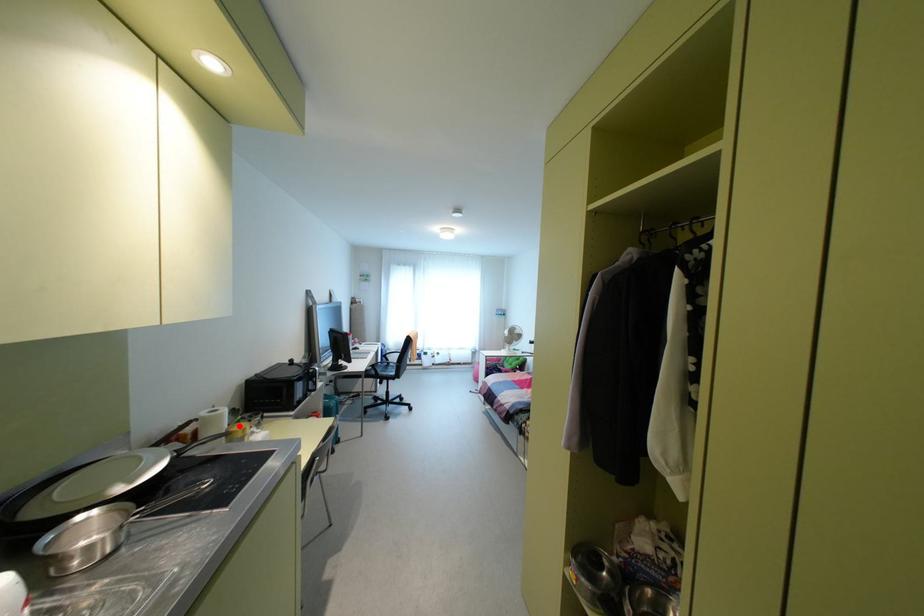
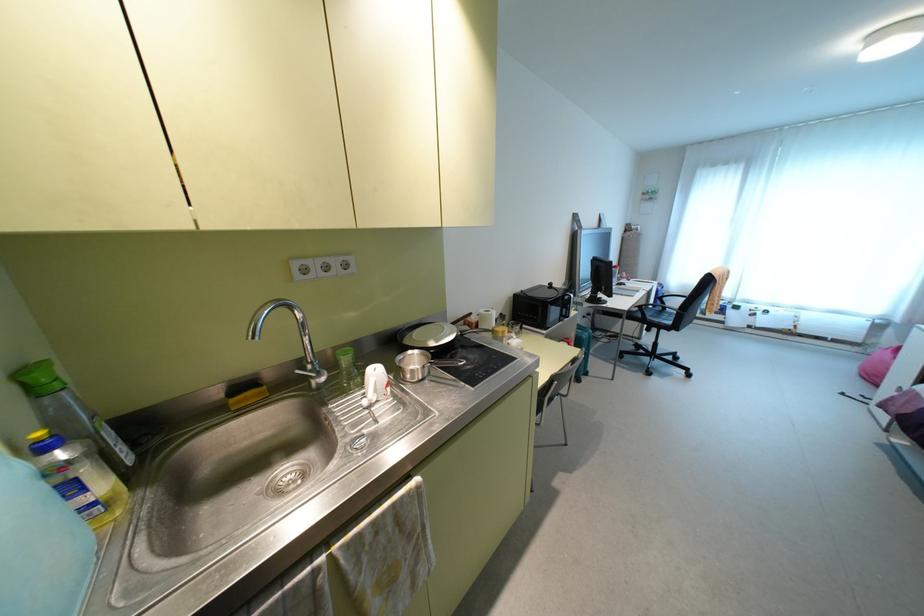
In the second image, find the point that corresponds to the highlighted location in the first image.

(500, 328)